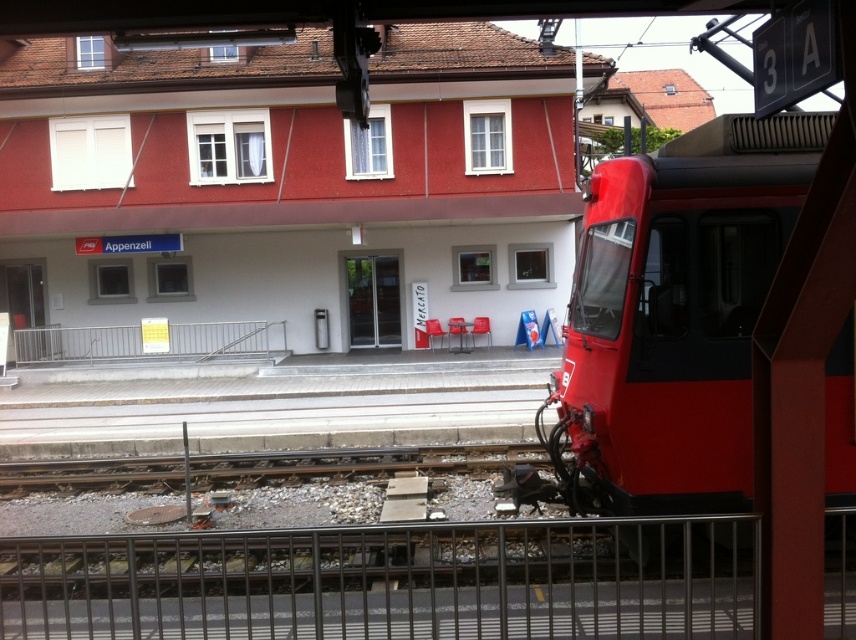
You are a passenger waiting on the platform and want to board the matte red train at right. You notice the metallic gray rail at center nearby. Is the train positioned higher or lower than the rail?

The matte red train at right is above the metallic gray rail at center, so the train is positioned higher than the rail.

You are standing on the railway station platform looking at the red train on the right. There are two points marked on the platform floor. The first point is at coordinates point (337, 595) and the second point is at point (241, 323). Which point is closer to you, the viewer?

Point (337, 595) is in front of point (241, 323), so the first point is closer to you.

You are standing on the railway station platform and want to take a photo. You notice two points marked on the platform floor at coordinates point(678, 340) and point(27, 358). Which point is closer to your current position?

Point(678, 340) is closer to the camera than point(27, 358), so it is closer to your current position.